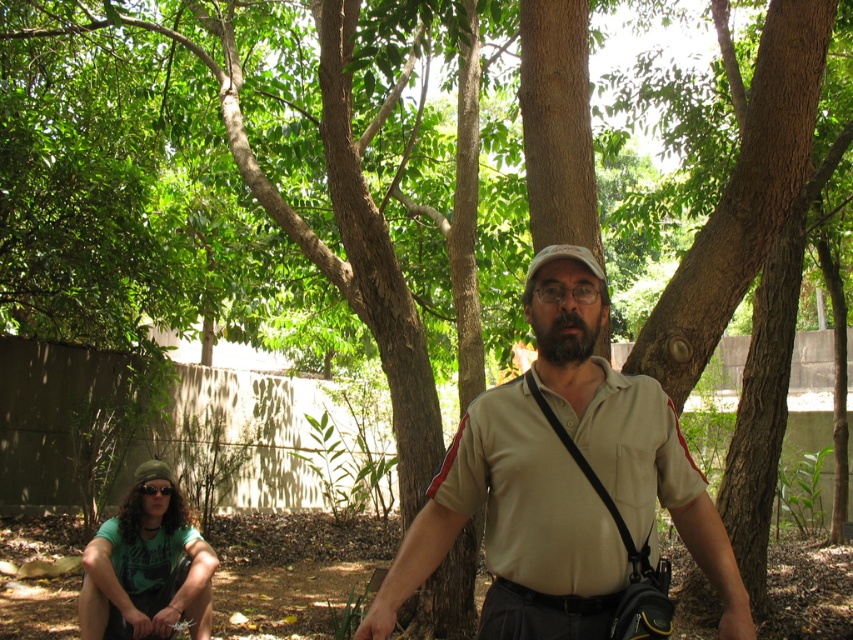
Can you confirm if beige cotton shirt at center is bigger than green fabric shirt at lower left?

Incorrect, beige cotton shirt at center is not larger than green fabric shirt at lower left.

Is beige cotton shirt at center thinner than green fabric shirt at lower left?

Incorrect, beige cotton shirt at center's width is not less than green fabric shirt at lower left's.

You are a GUI agent. You are given a task and a screenshot of the screen. Output one action in this format:
    pyautogui.click(x=<x>, y=<y>)
    Task: Click on the beige cotton shirt at center
    
    Given the screenshot: What is the action you would take?
    pyautogui.click(x=512, y=528)

Find the location of `beige cotton shirt at center`. beige cotton shirt at center is located at coordinates (512, 528).